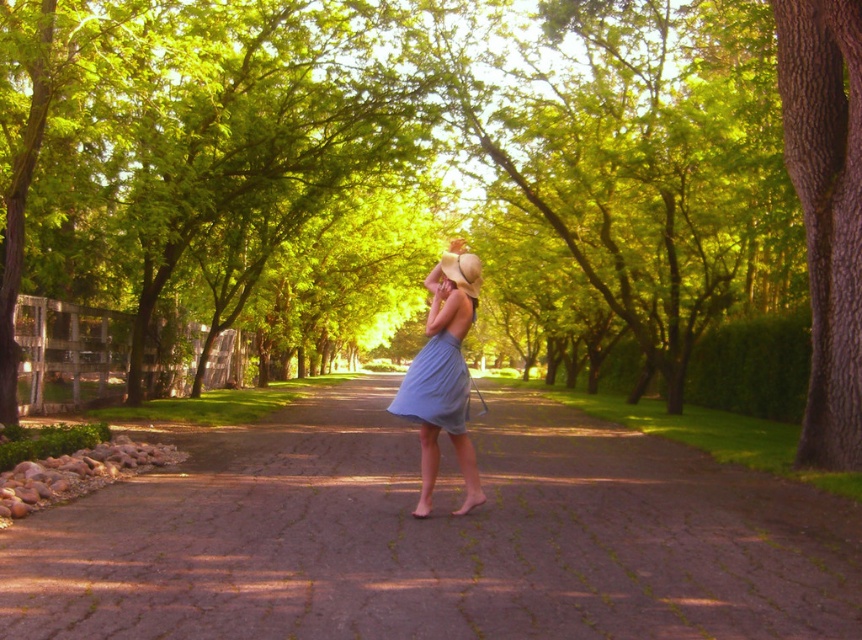
Between green leafy tree at center and light blue fabric skirt at center, which one has less height?

light blue fabric skirt at center is shorter.

Who is lower down, green leafy tree at center or light blue fabric skirt at center?

Positioned lower is light blue fabric skirt at center.

At what (x,y) coordinates should I click in order to perform the action: click on green leafy tree at center. Please return your answer as a coordinate pair (x, y). The width and height of the screenshot is (862, 640). Looking at the image, I should click on (442, 177).

Does brown rough bark tree at right appear under light blue fabric skirt at center?

Incorrect, brown rough bark tree at right is not positioned below light blue fabric skirt at center.

Between point (798, 186) and point (420, 358), which one is positioned behind?

Positioned behind is point (798, 186).

At what (x,y) coordinates should I click in order to perform the action: click on brown rough bark tree at right. Please return your answer as a coordinate pair (x, y). Image resolution: width=862 pixels, height=640 pixels. Looking at the image, I should click on (826, 211).

Can you confirm if light blue fabric dress at center is smaller than light blue fabric skirt at center?

No.

Measure the distance between light blue fabric dress at center and camera.

light blue fabric dress at center and camera are 7.23 meters apart.

Identify the location of light blue fabric dress at center. (442, 376).